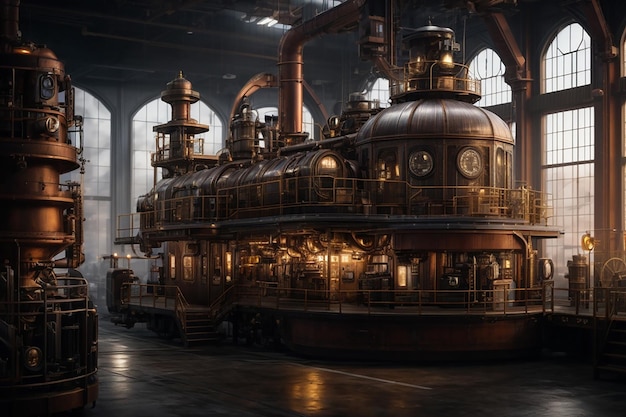
I want to click on light, so click(272, 20).